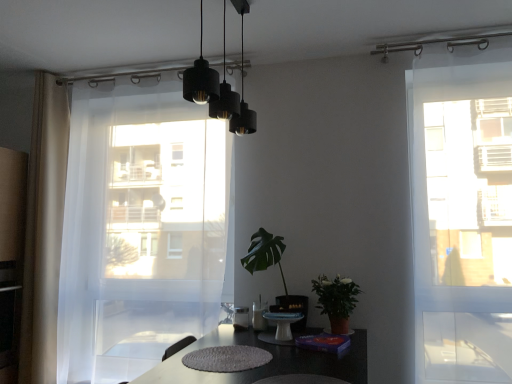
Question: Is green leafy plant at center, which is the second houseplant from right to left, next to white sheer curtain at left, which is counted as the first curtain, starting from the left, and touching it?

Choices:
 (A) yes
 (B) no

Answer: (B)

Question: Considering the relative sizes of green leafy plant at center, which is the second houseplant from right to left, and white sheer curtain at left, which is counted as the first curtain, starting from the left, in the image provided, is green leafy plant at center, which is the second houseplant from right to left, shorter than white sheer curtain at left, which is counted as the first curtain, starting from the left,?

Choices:
 (A) no
 (B) yes

Answer: (B)

Question: Does green leafy plant at center, which appears as the first houseplant when viewed from the left, lie behind white sheer curtain at left, marked as the second curtain in a right-to-left arrangement?

Choices:
 (A) no
 (B) yes

Answer: (A)

Question: Is green leafy plant at center, which appears as the first houseplant when viewed from the left, turned away from white sheer curtain at left, which is counted as the first curtain, starting from the left?

Choices:
 (A) yes
 (B) no

Answer: (B)

Question: Is green leafy plant at center, which is the second houseplant from right to left, to the left of white sheer curtain at left, marked as the second curtain in a right-to-left arrangement, from the viewer's perspective?

Choices:
 (A) yes
 (B) no

Answer: (B)

Question: Is green leafy plant at center, which appears as the first houseplant when viewed from the left, to the right of white sheer curtain at left, which is counted as the first curtain, starting from the left, from the viewer's perspective?

Choices:
 (A) no
 (B) yes

Answer: (B)

Question: Is transparent glass door at right directly adjacent to green leafy plant at center, which appears as the first houseplant when viewed from the left?

Choices:
 (A) no
 (B) yes

Answer: (A)

Question: Is transparent glass door at right shorter than green leafy plant at center, which appears as the first houseplant when viewed from the left?

Choices:
 (A) no
 (B) yes

Answer: (A)

Question: From a real-world perspective, is transparent glass door at right positioned under green leafy plant at center, which appears as the first houseplant when viewed from the left, based on gravity?

Choices:
 (A) yes
 (B) no

Answer: (B)

Question: Considering the relative positions of transparent glass door at right and green leafy plant at center, which appears as the first houseplant when viewed from the left, in the image provided, is transparent glass door at right in front of green leafy plant at center, which appears as the first houseplant when viewed from the left,?

Choices:
 (A) yes
 (B) no

Answer: (A)

Question: From a real-world perspective, does transparent glass door at right stand above green leafy plant at center, which is the second houseplant from right to left?

Choices:
 (A) yes
 (B) no

Answer: (A)

Question: From the image's perspective, is transparent glass door at right located above green leafy plant at center, which is the second houseplant from right to left?

Choices:
 (A) yes
 (B) no

Answer: (A)

Question: Does white sheer curtain at left, positioned as the first curtain in right-to-left order, lie in front of white sheer curtain at left, which is counted as the first curtain, starting from the left?

Choices:
 (A) no
 (B) yes

Answer: (B)